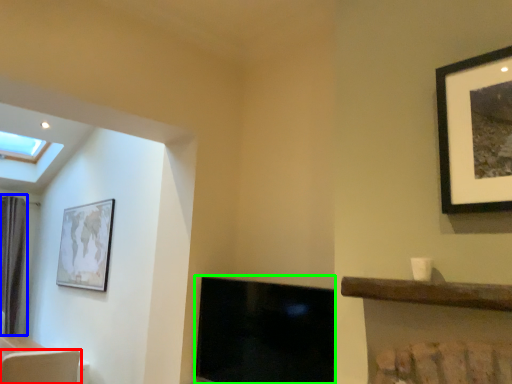
Question: Considering the real-world distances, which object is closest to swivel chair (highlighted by a red box)? curtain (highlighted by a blue box) or fireplace (highlighted by a green box).

Choices:
 (A) curtain
 (B) fireplace

Answer: (B)